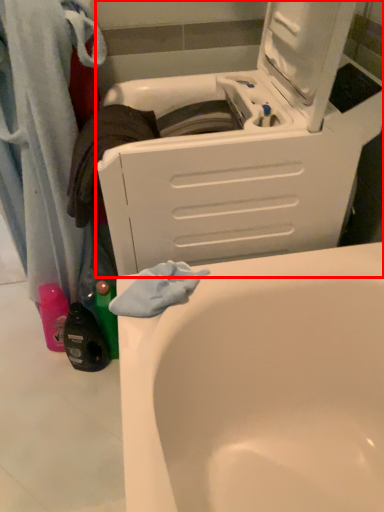
Question: Where is washing machine (annotated by the red box) located in relation to bathtub in the image?

Choices:
 (A) right
 (B) left

Answer: (A)